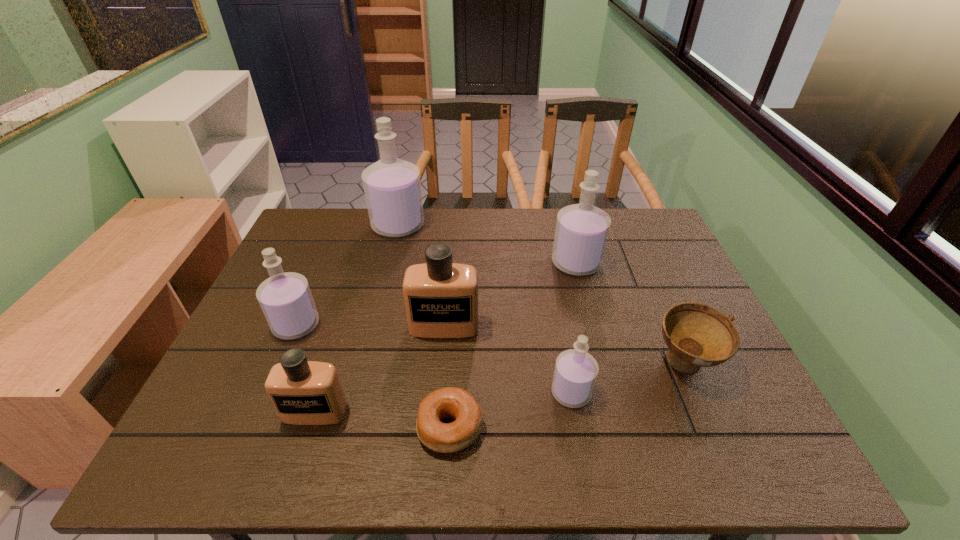
Find the location of `the smaller beige perfume`. the smaller beige perfume is located at coordinates (303, 392).

Find the location of a particular element. The height and width of the screenshot is (540, 960). the rightmost object is located at coordinates (x=697, y=335).

Find the location of `soup bowl`. soup bowl is located at coordinates (x=697, y=335).

The height and width of the screenshot is (540, 960). I want to click on bagel, so click(x=455, y=403).

The height and width of the screenshot is (540, 960). I want to click on blank area located 0.140m on the left of the farthest object, so click(329, 226).

Find the location of a particular element. This screenshot has width=960, height=540. free space located on the back of the fifth shortest perfume is located at coordinates (568, 235).

Identify the location of free space located 0.390m on the right of the leftmost purple perfume. This screenshot has width=960, height=540. (472, 325).

Find the location of a particular element. This screenshot has width=960, height=540. free space located 0.300m on the front label of the right beige perfume is located at coordinates (433, 456).

Where is `vacant area situated 0.080m on the right of the smallest purple perfume`? This screenshot has width=960, height=540. vacant area situated 0.080m on the right of the smallest purple perfume is located at coordinates (627, 393).

The image size is (960, 540). Identify the location of vacant space located on the back of the soup bowl. (661, 314).